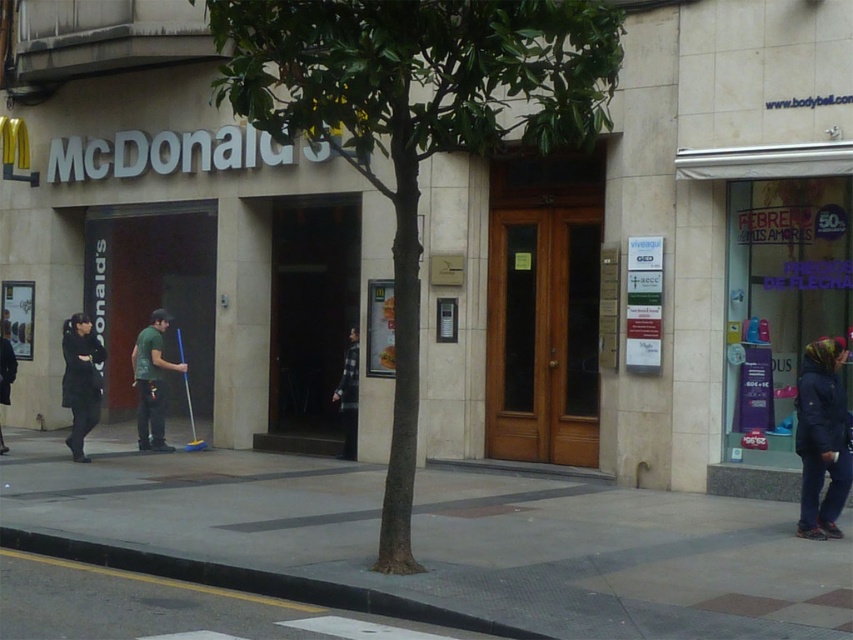
You are a delivery person who needs to park your motorcycle between the green leafy tree at center and the black leather jacket at left. Can you fit your motorcycle there if it requires 1.2 meters of space?

The green leafy tree at center might be wider than black leather jacket at left, but the exact width isn not specified. Without knowing the actual distance between them, it is uncertain if the motorcycle will fit.

You are a delivery driver who needs to park your vehicle near the McDonalds restaurant. The parking spot you found is located at coordinate point 0.2, 0.5. Is the green leafy tree at center blocking your path to the parking spot?

The green leafy tree at center is located at point (416, 122), which is very close to the parking spot at (426, 128). Depending on the exact positioning, the tree might slightly obstruct the path, so caution is advised.